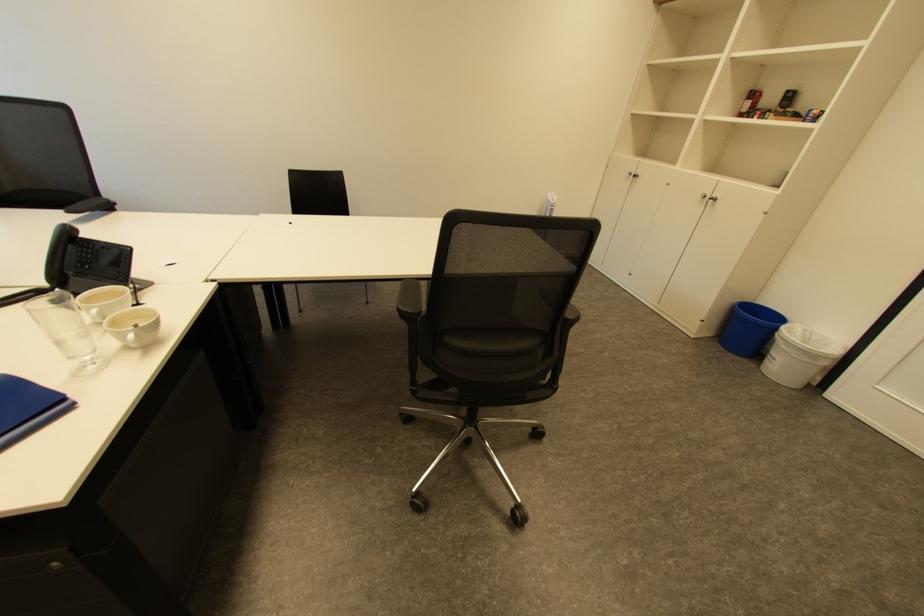
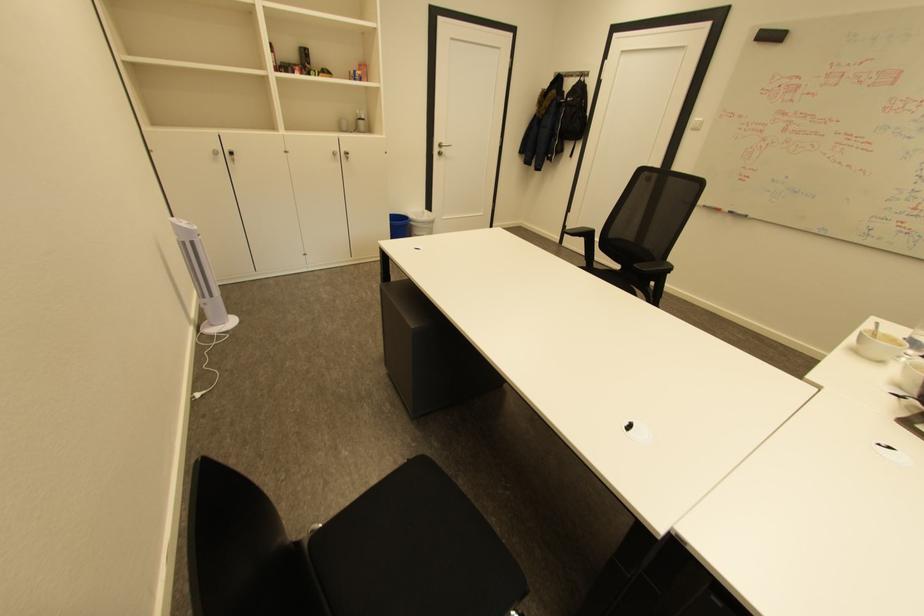
Where in the second image is the point corresponding to point (793, 351) from the first image?

(432, 227)